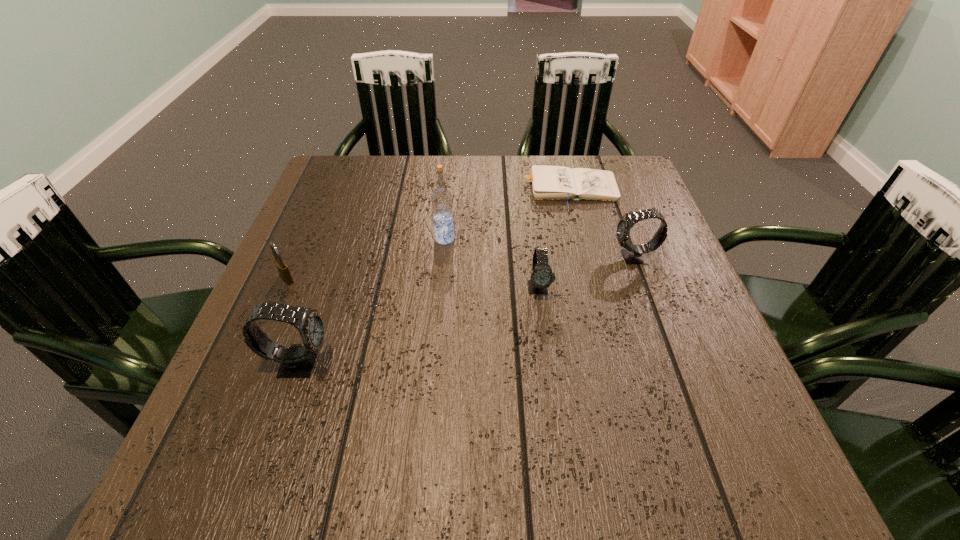
The width and height of the screenshot is (960, 540). Find the location of `free space for an extra watch to achieve even spacing`. free space for an extra watch to achieve even spacing is located at coordinates (428, 322).